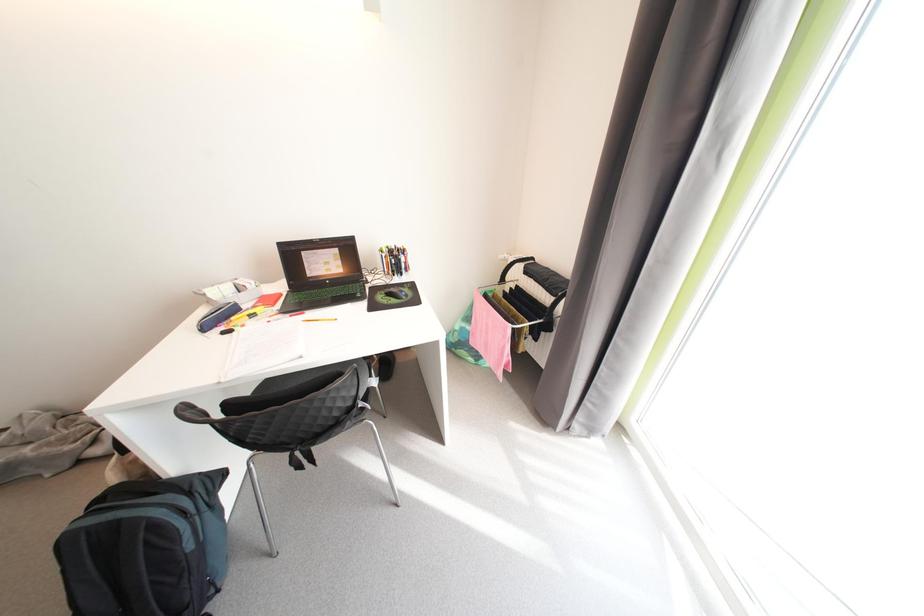
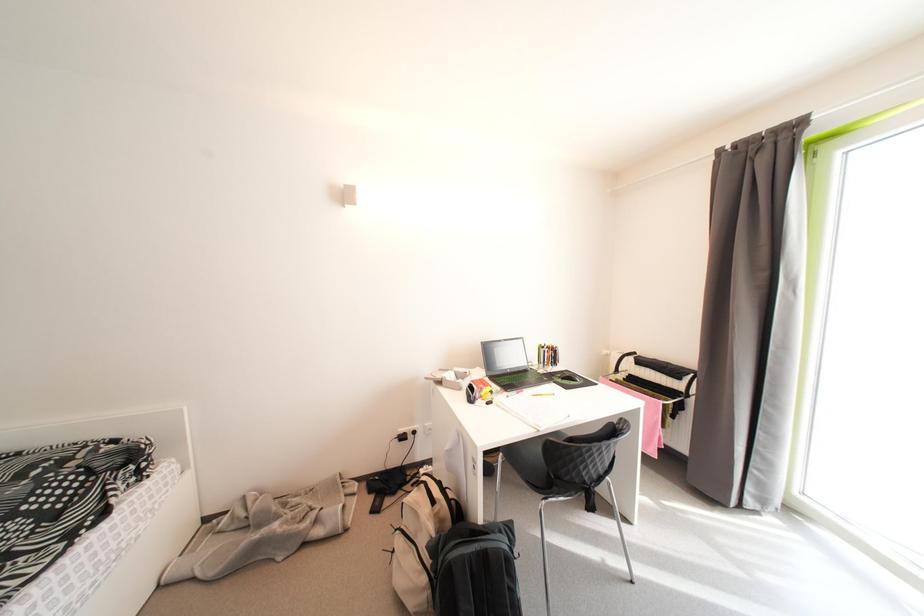
In a continuous first-person perspective shot, in which direction is the camera moving?

The movement direction of the cameraman is left, backward.